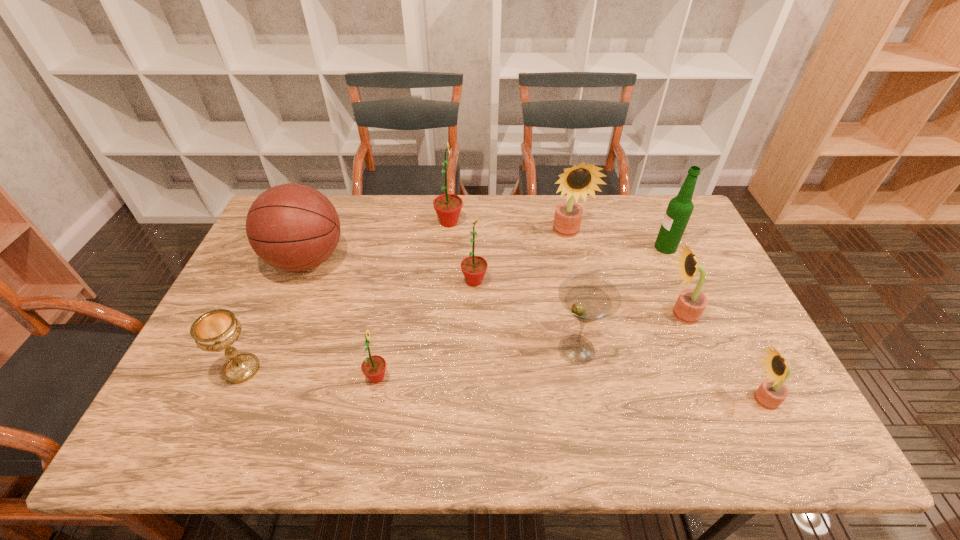
Image resolution: width=960 pixels, height=540 pixels. I want to click on free space located 0.110m on the face of the nearest green sunflower, so click(434, 377).

Where is `free space located on the right of the chalice`? This screenshot has width=960, height=540. free space located on the right of the chalice is located at coordinates (413, 369).

This screenshot has width=960, height=540. In order to click on basketball present at the far edge in this screenshot , I will do `click(293, 227)`.

Find the location of a particular element. Image resolution: width=960 pixels, height=540 pixels. object present at the near edge is located at coordinates (772, 392).

Identify the location of basketball that is positioned at the left edge. The width and height of the screenshot is (960, 540). (293, 227).

Where is `chalice at the left edge`? The image size is (960, 540). chalice at the left edge is located at coordinates (218, 329).

Locate an element on the screen. beer bottle that is positioned at the right edge is located at coordinates (679, 210).

The image size is (960, 540). Find the location of `object that is at the far left corner`. object that is at the far left corner is located at coordinates (293, 227).

Find the location of `object at the near right corner`. object at the near right corner is located at coordinates 772,392.

In the image, there is a desktop. Where is `vacant space at the far edge`? This screenshot has width=960, height=540. vacant space at the far edge is located at coordinates (345, 207).